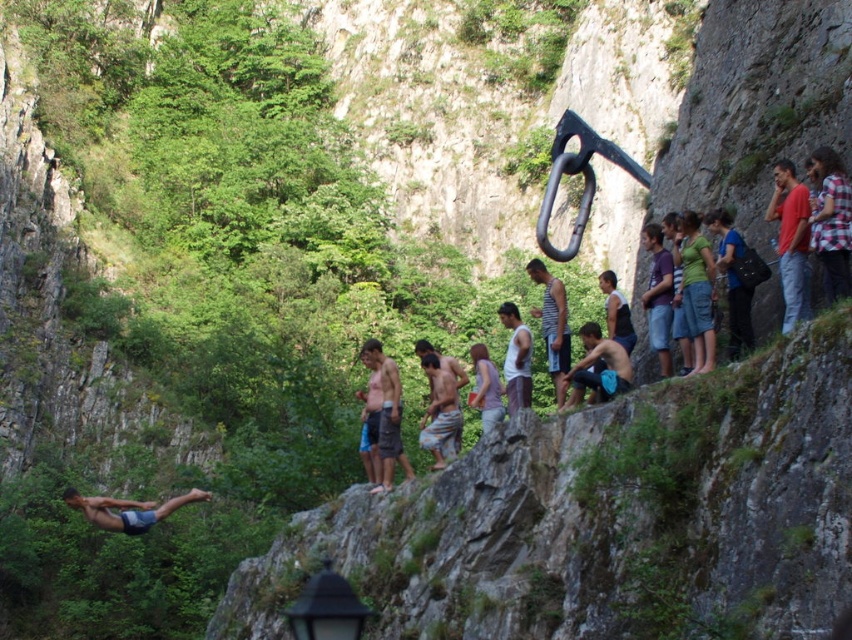
You are standing at the point labeled point at (792,195). You want to jump to the valley below. The cliff is 115.90 feet away from you. Is the cliff far enough for you to safely land in the valley?

The cliff is 115.90 feet away from the point at (792,195). Since the cliff is steep and rocky, jumping from this point may not be safe as the distance to the valley is significant. However, the exact safety depends on factors like the jumper s skill and the terrain below, which are not specified here.